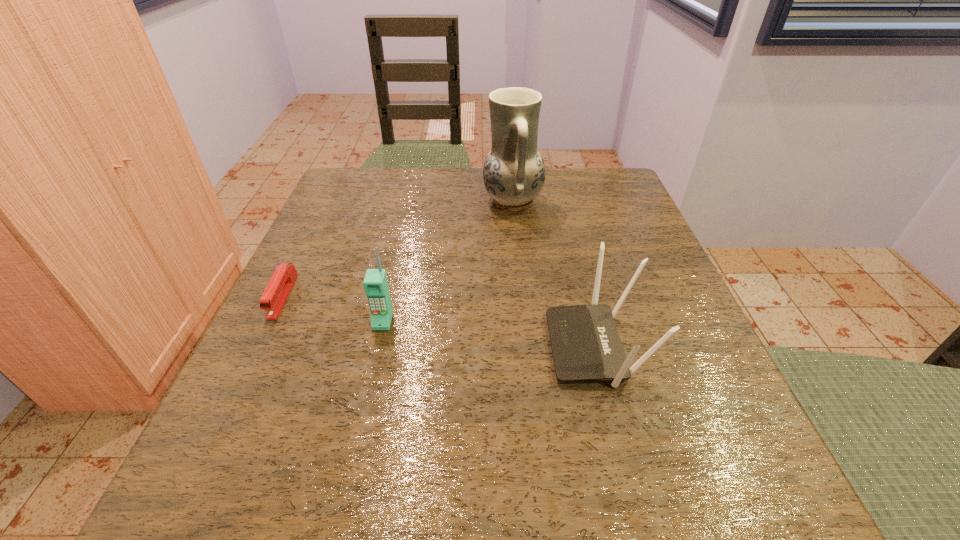
Identify the location of unoccupied area between the third object from right to left and the shortest object. This screenshot has height=540, width=960. (333, 309).

Find the location of a particular element. The width and height of the screenshot is (960, 540). blank region between the farthest object and the cellular telephone is located at coordinates (447, 261).

Locate an element on the screen. This screenshot has height=540, width=960. free space between the shortest object and the farthest object is located at coordinates (397, 249).

Where is `vacant area between the farthest object and the router`? vacant area between the farthest object and the router is located at coordinates (554, 274).

This screenshot has height=540, width=960. In order to click on free space that is in between the farthest object and the cellular telephone in this screenshot , I will do `click(447, 261)`.

Where is `free space between the second object from left to right and the router`? The image size is (960, 540). free space between the second object from left to right and the router is located at coordinates (490, 334).

At what (x,y) coordinates should I click in order to perform the action: click on vacant space in between the tallest object and the stapler. Please return your answer as a coordinate pair (x, y). The width and height of the screenshot is (960, 540). Looking at the image, I should click on 397,249.

The image size is (960, 540). I want to click on vacant space in between the leftmost object and the router, so click(x=440, y=321).

Find the location of a particular element. free space between the router and the third object from right to left is located at coordinates (490, 334).

I want to click on free space between the stapler and the tallest object, so click(397, 249).